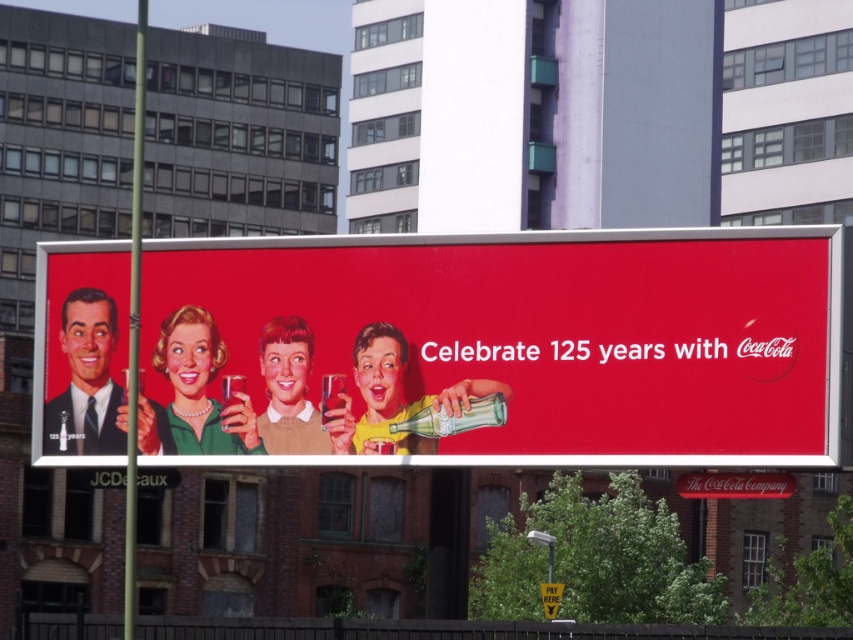
Question: Is matte plastic bottle at center thinner than smooth plastic cup at center?

Choices:
 (A) yes
 (B) no

Answer: (B)

Question: Estimate the real-world distances between objects in this image. Which object is closer to the matte black suit at left?

Choices:
 (A) matte green dress at center
 (B) smooth plastic cup at center

Answer: (A)

Question: Estimate the real-world distances between objects in this image. Which object is closer to the matte red billboard at center?

Choices:
 (A) matte black suit at left
 (B) matte green dress at center
 (C) matte plastic bottle at center
 (D) smooth plastic cup at center

Answer: (D)

Question: Does matte red billboard at center lie behind matte black suit at left?

Choices:
 (A) yes
 (B) no

Answer: (B)

Question: Where is matte green dress at center located in relation to matte plastic bottle at center in the image?

Choices:
 (A) above
 (B) below

Answer: (A)

Question: Which object is positioned farthest from the matte red billboard at center?

Choices:
 (A) matte black suit at left
 (B) matte plastic bottle at center
 (C) smooth plastic cup at center
 (D) matte green dress at center

Answer: (D)